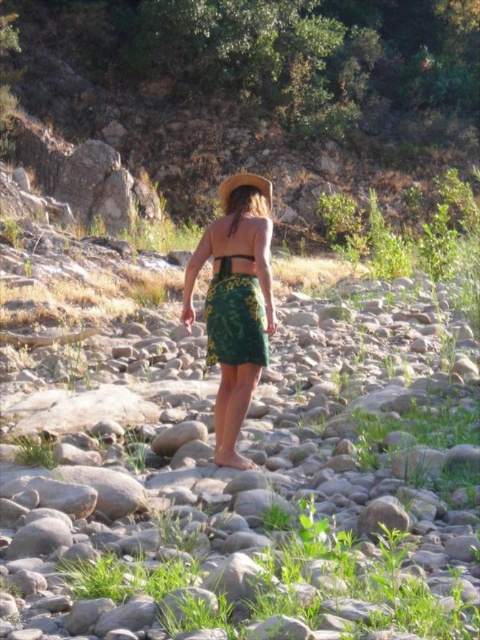
Question: Where is matte green bikini top at center located in relation to green fabric bikini top at back in the image?

Choices:
 (A) above
 (B) below

Answer: (B)

Question: Among these points, which one is nearest to the camera?

Choices:
 (A) (218, 262)
 (B) (228, 257)

Answer: (B)

Question: From the image, what is the correct spatial relationship of green floral skirt at center in relation to brown straw hat at upper center?

Choices:
 (A) above
 (B) below

Answer: (B)

Question: Among these objects, which one is farthest from the camera?

Choices:
 (A) matte green bikini top at center
 (B) green floral skirt at center
 (C) green fabric bikini top at back
 (D) brown straw hat at upper center

Answer: (D)

Question: Which object is closer to the camera taking this photo?

Choices:
 (A) green fabric bikini top at back
 (B) green woven skirt at center
 (C) brown straw hat at upper center
 (D) green floral skirt at center

Answer: (D)

Question: Can you confirm if green woven skirt at center is thinner than matte green bikini top at center?

Choices:
 (A) yes
 (B) no

Answer: (B)